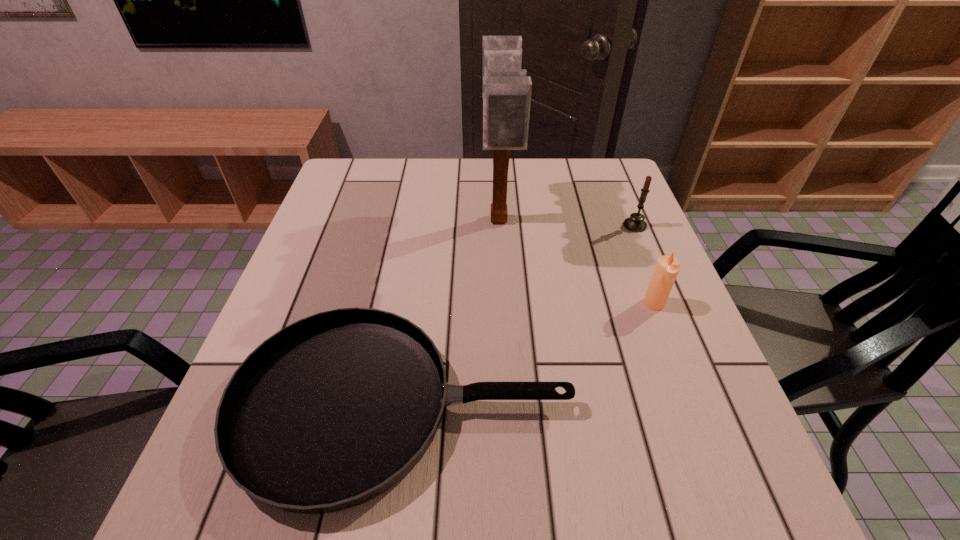
Where is `mallet`? This screenshot has height=540, width=960. mallet is located at coordinates (506, 89).

The image size is (960, 540). Identify the location of the farther candle. (635, 223).

Where is `the nearer candle`? The image size is (960, 540). the nearer candle is located at coordinates (667, 268).

Find the location of a particular element. The width and height of the screenshot is (960, 540). the nearest object is located at coordinates (333, 410).

You are a GUI agent. You are given a task and a screenshot of the screen. Output one action in this format:
    pyautogui.click(x=<x>, y=<y>)
    Task: Click on the shortest object
    This screenshot has width=960, height=540.
    Given the screenshot: What is the action you would take?
    pyautogui.click(x=333, y=410)

This screenshot has width=960, height=540. I want to click on vacant space located 0.110m on the right of the tallest object, so click(557, 221).

Find the location of a particular element. vacant space located on the front of the farther candle is located at coordinates (666, 301).

The width and height of the screenshot is (960, 540). I want to click on vacant space located 0.160m on the back of the nearer candle, so click(633, 248).

What are the coordinates of `vacant region located on the handle side of the shortest object` in the screenshot? It's located at (725, 405).

Where is `object positioned at the far edge`? object positioned at the far edge is located at coordinates (506, 89).